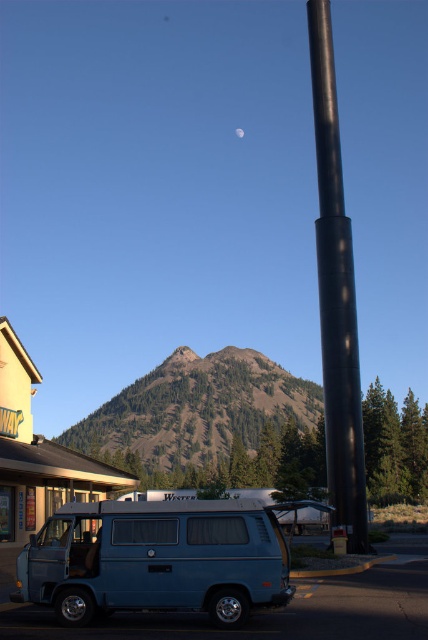
I want to click on blue matte van at lower left, so click(x=157, y=560).

Who is more forward, (143, 572) or (326, 205)?

Point (143, 572) is more forward.

You are a GUI agent. You are given a task and a screenshot of the screen. Output one action in this format:
    pyautogui.click(x=<x>, y=<y>)
    Task: Click on the blue matte van at lower left
    Image resolution: width=428 pixels, height=640 pixels.
    Given the screenshot: What is the action you would take?
    point(157,560)

The width and height of the screenshot is (428, 640). What do you see at coordinates (157, 560) in the screenshot?
I see `blue matte van at lower left` at bounding box center [157, 560].

Find the location of a particular element. blue matte van at lower left is located at coordinates (157, 560).

Consider the image. Does green textured mountain at center appear on the right side of black matte pole at center?

In fact, green textured mountain at center is to the left of black matte pole at center.

Between green textured mountain at center and black matte pole at center, which one is positioned higher?

black matte pole at center is higher up.

I want to click on green textured mountain at center, so click(x=211, y=422).